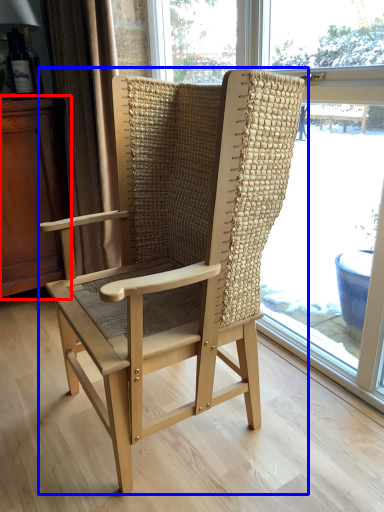
Question: Which object appears closest to the camera in this image, dresser (highlighted by a red box) or chair (highlighted by a blue box)?

Choices:
 (A) dresser
 (B) chair

Answer: (B)